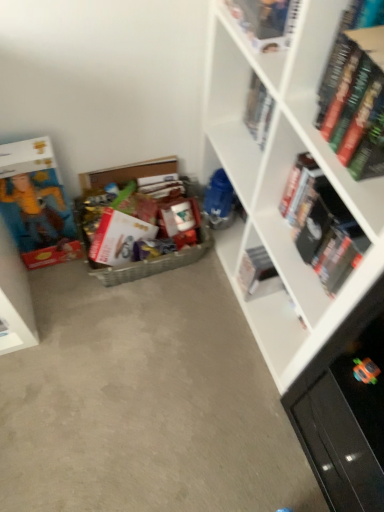
Question: From a real-world perspective, is hardcover book at upper right, which is the 5th book from left to right, positioned under hardcover book at upper right, which appears as the sixth book when viewed from the left, based on gravity?

Choices:
 (A) no
 (B) yes

Answer: (B)

Question: Is hardcover book at upper right, which is the second book in right-to-left order, at the right side of hardcover book at upper right, which appears as the sixth book when viewed from the left?

Choices:
 (A) no
 (B) yes

Answer: (A)

Question: From a real-world perspective, does hardcover book at upper right, which is the second book in right-to-left order, stand above hardcover book at upper right, which appears as the sixth book when viewed from the left?

Choices:
 (A) no
 (B) yes

Answer: (A)

Question: Is hardcover book at upper right, which is the 5th book from left to right, at the left side of hardcover book at upper right, positioned as the 1th book in right-to-left order?

Choices:
 (A) yes
 (B) no

Answer: (A)

Question: Can you confirm if hardcover book at upper right, which is the 5th book from left to right, is taller than hardcover book at upper right, positioned as the 1th book in right-to-left order?

Choices:
 (A) yes
 (B) no

Answer: (A)

Question: In the image, is hardcover book at upper right, which appears as the sixth book when viewed from the left, on the left side or the right side of white matte book at center, the 4th book viewed from the left?

Choices:
 (A) left
 (B) right

Answer: (B)

Question: Is hardcover book at upper right, which appears as the sixth book when viewed from the left, situated inside white matte book at center, which is the third book in right-to-left order, or outside?

Choices:
 (A) outside
 (B) inside

Answer: (A)

Question: From a real-world perspective, is hardcover book at upper right, positioned as the 1th book in right-to-left order, physically located above or below white matte book at center, the 4th book viewed from the left?

Choices:
 (A) below
 (B) above

Answer: (B)

Question: Is point (369, 157) closer or farther from the camera than point (243, 281)?

Choices:
 (A) farther
 (B) closer

Answer: (B)

Question: In the image, is hardcover book at upper right, which is the second book in right-to-left order, positioned in front of or behind matte cardboard box at left?

Choices:
 (A) behind
 (B) front

Answer: (B)

Question: Based on their positions, is hardcover book at upper right, which is the second book in right-to-left order, located to the left or right of matte cardboard box at left?

Choices:
 (A) left
 (B) right

Answer: (B)

Question: From the image's perspective, is hardcover book at upper right, which is the second book in right-to-left order, above or below matte cardboard box at left?

Choices:
 (A) above
 (B) below

Answer: (B)

Question: Is hardcover book at upper right, which is the 5th book from left to right, inside or outside of matte cardboard box at left?

Choices:
 (A) inside
 (B) outside

Answer: (B)

Question: From the image's perspective, is matte cardboard box at left positioned above or below hardcover book at upper center, the fourth book when ordered from right to left?

Choices:
 (A) above
 (B) below

Answer: (B)

Question: In terms of height, does matte cardboard box at left look taller or shorter compared to hardcover book at upper center, the fourth book when ordered from right to left?

Choices:
 (A) tall
 (B) short

Answer: (A)